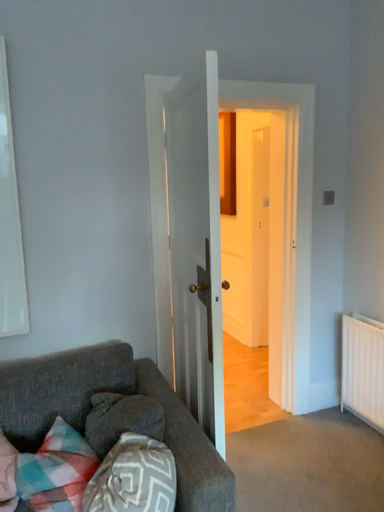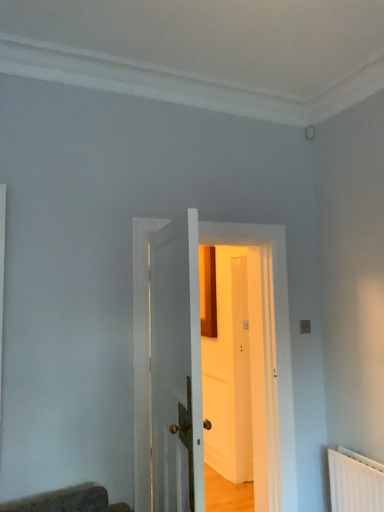
Question: How did the camera likely rotate when shooting the video?

Choices:
 (A) rotated upward
 (B) rotated downward

Answer: (A)